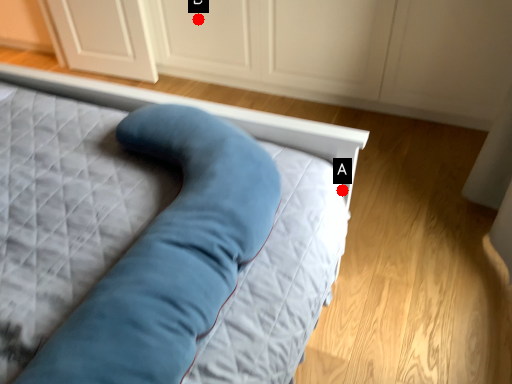
Question: Two points are circled on the image, labeled by A and B beside each circle. Among these points, which one is nearest to the camera?

Choices:
 (A) A is closer
 (B) B is closer

Answer: (A)